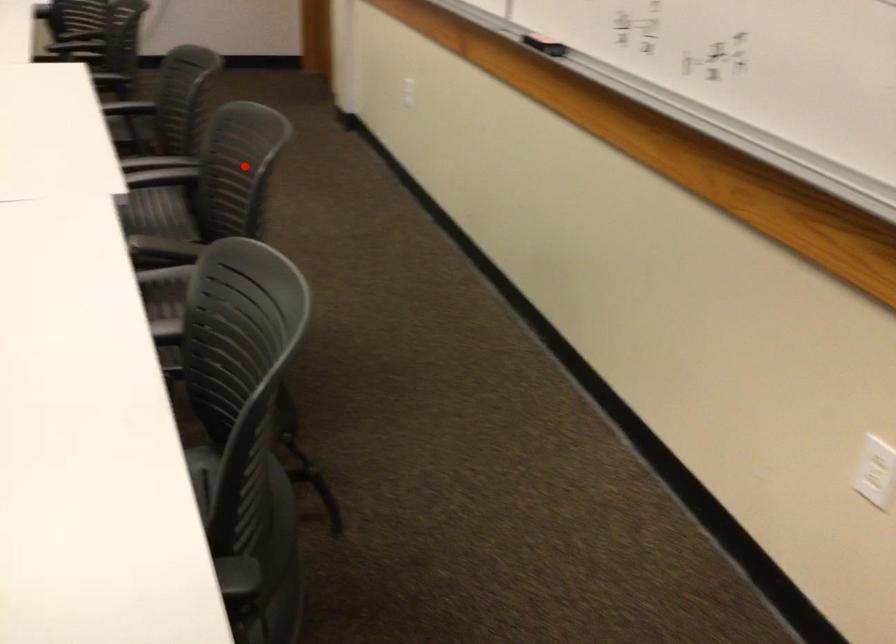
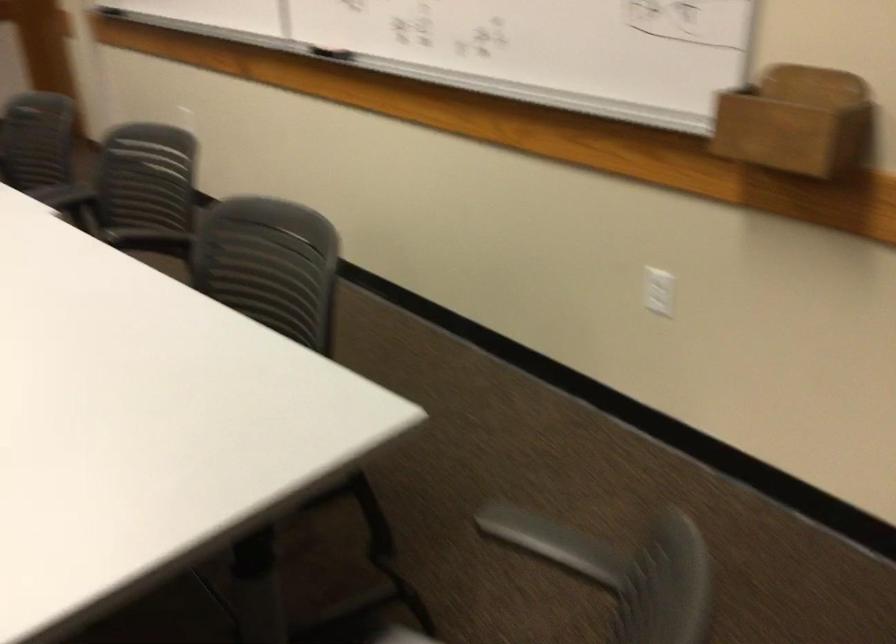
Question: I am providing you with two images of the same scene from different viewpoints. Given a red point in image1, look at the same physical point in image2. Is it:

Choices:
 (A) Closer to the viewpoint
 (B) Farther from the viewpoint

Answer: (B)